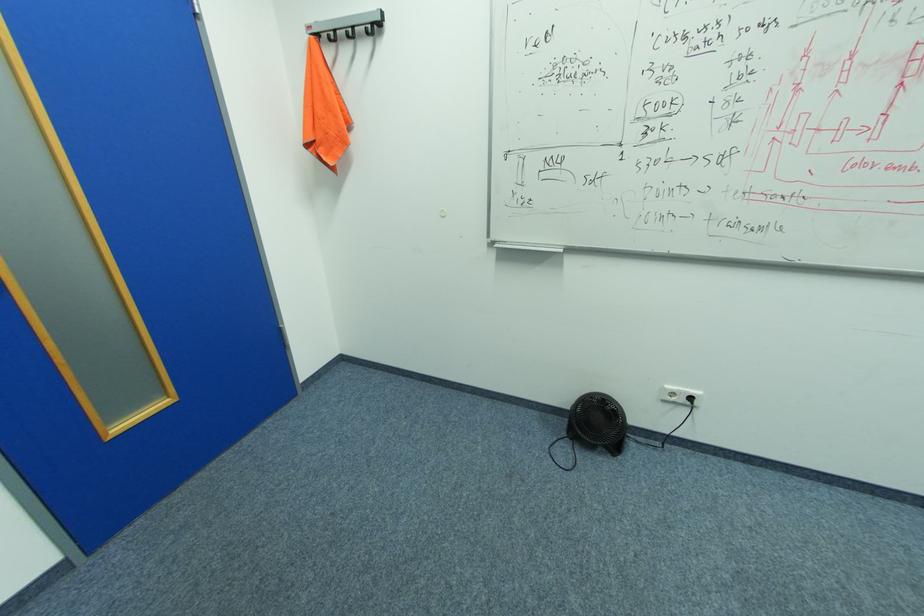
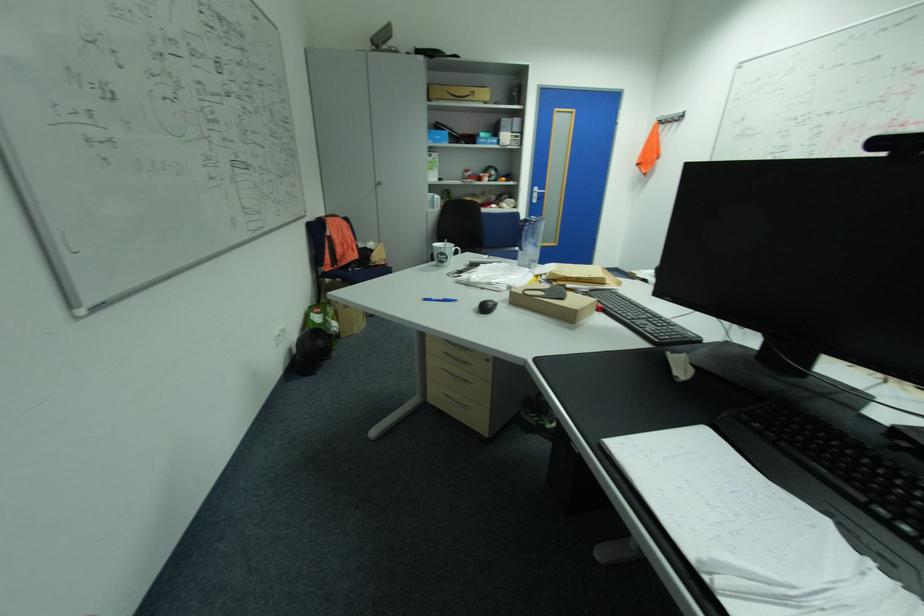
Question: I am providing you with two images of the same scene from different viewpoints. Please identify which objects are invisible in image2.

Choices:
 (A) wall hook
 (B) black computer mouse
 (C) window crank handle
 (D) small cardboard box

Answer: (A)